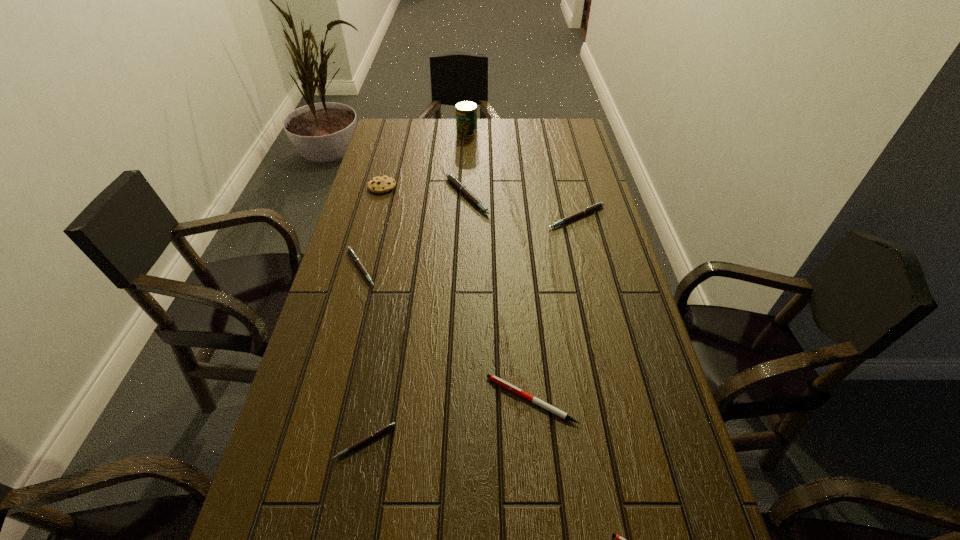
The image size is (960, 540). Find the location of `free space located 0.320m on the clicker of the farther white pen`. free space located 0.320m on the clicker of the farther white pen is located at coordinates (341, 400).

Where is `free point located at the nib of the nearest pink pen`? free point located at the nib of the nearest pink pen is located at coordinates (350, 528).

Locate an element on the screen. The width and height of the screenshot is (960, 540). object at the far edge is located at coordinates (466, 111).

Locate an element on the screen. cookie that is at the left edge is located at coordinates (380, 184).

Where is `object that is at the right edge`? Image resolution: width=960 pixels, height=540 pixels. object that is at the right edge is located at coordinates (598, 205).

Where is `vacant region at the far edge of the desktop`? The height and width of the screenshot is (540, 960). vacant region at the far edge of the desktop is located at coordinates (428, 147).

Find the location of a particular element. vacant area at the left edge of the desktop is located at coordinates (313, 336).

Where is `vacant space at the right edge`? Image resolution: width=960 pixels, height=540 pixels. vacant space at the right edge is located at coordinates (555, 162).

Identify the location of free space at the far left corner of the desktop. (396, 126).

Find the location of a particular element. The image size is (960, 540). vacant space at the far right corner is located at coordinates (570, 139).